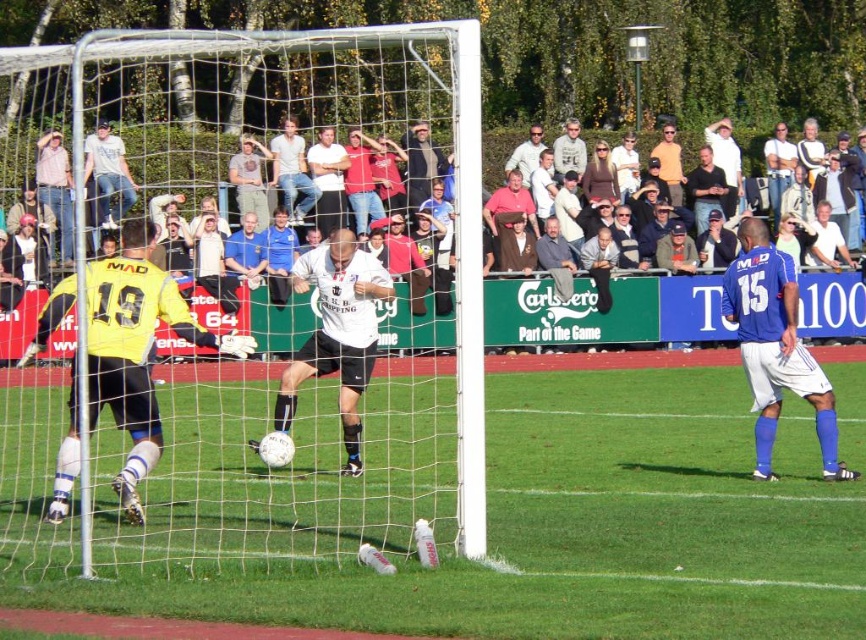
You are a soccer referee assessing the field setup. The rules state that the goal net must be at least 2 meters taller than any nearby player. Based on the scene, does the white mesh net at center meet this requirement compared to the blue jersey at right?

The white mesh net at center is taller than blue jersey at right, so it meets the requirement of being at least 2 meters taller as per the rules.

You are a soccer coach analyzing the match from the sidelines. You see the blue jersey at right and the camera. How far apart are they?

The blue jersey at right and the camera are 12.88 meters apart.